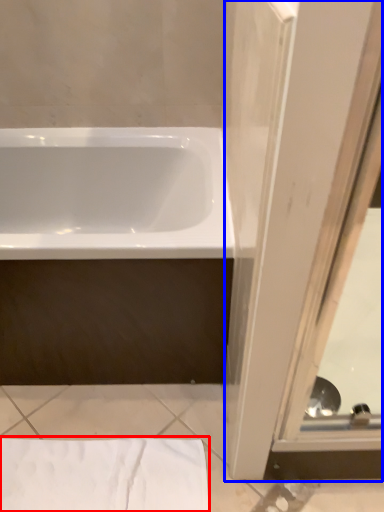
Question: Which of the following is the farthest to the observer, sheet (highlighted by a red box) or screen door (highlighted by a blue box)?

Choices:
 (A) sheet
 (B) screen door

Answer: (A)